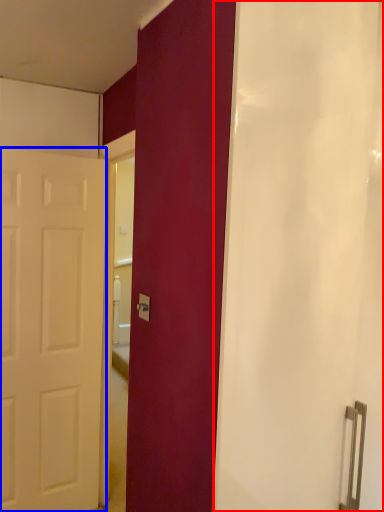
Question: Among these objects, which one is nearest to the camera, shower curtain (highlighted by a red box) or door (highlighted by a blue box)?

Choices:
 (A) shower curtain
 (B) door

Answer: (A)